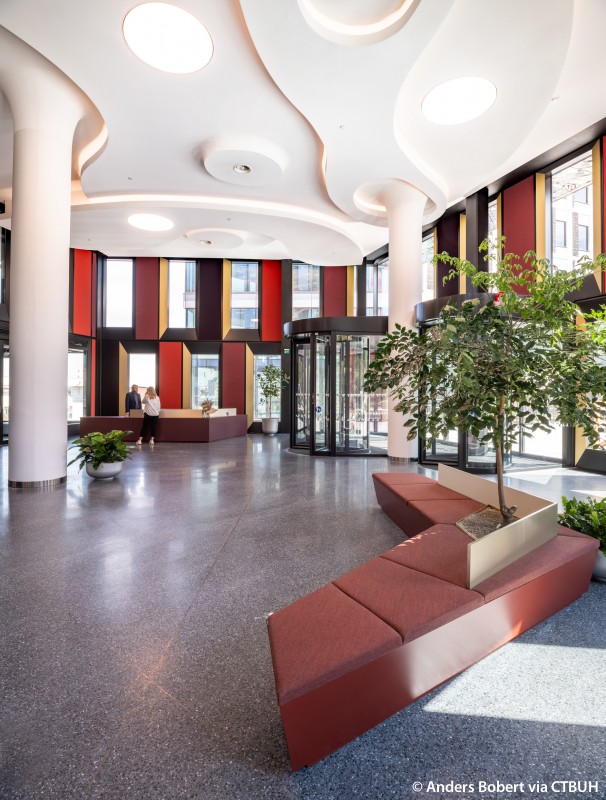
You are a GUI agent. You are given a task and a screenshot of the screen. Output one action in this format:
    pyautogui.click(x=<x>, y=<y>)
    Task: Click on the ceiling
    The image size is (606, 800).
    Given the screenshot: What is the action you would take?
    pyautogui.click(x=236, y=93)